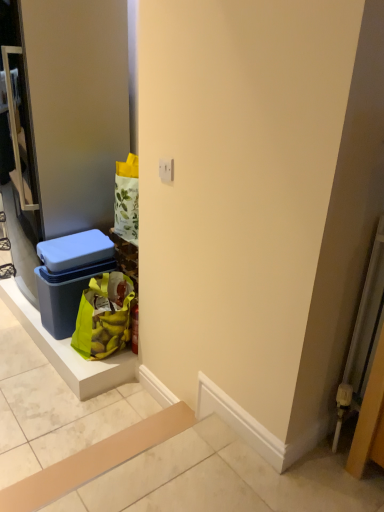
The image size is (384, 512). In order to click on blue plastic door at left in this screenshot , I will do `click(77, 106)`.

I want to click on green fabric shopping bag at lower left, so click(x=104, y=316).

The width and height of the screenshot is (384, 512). I want to click on blue plastic storage box at left, so click(69, 276).

From the image's perspective, which is below, blue plastic door at left or blue plastic storage box at left?

blue plastic storage box at left is shown below in the image.

In the image, is blue plastic door at left on the left side or the right side of blue plastic storage box at left?

Clearly, blue plastic door at left is on the left of blue plastic storage box at left in the image.

Which object is wider, blue plastic door at left or blue plastic storage box at left?

With larger width is blue plastic door at left.

The width and height of the screenshot is (384, 512). Identify the location of shopping bag on the right of the blue plastic door at left. (104, 316).

Which is in front, point (98, 350) or point (53, 168)?

The point (98, 350) is closer.

Is green fabric shopping bag at lower left not near blue plastic door at left?

No, there isn't a large distance between green fabric shopping bag at lower left and blue plastic door at left.

From a real-world perspective, does blue plastic storage box at left sit lower than blue plastic door at left?

Yes, from a real-world perspective, blue plastic storage box at left is under blue plastic door at left.

Between blue plastic storage box at left and blue plastic door at left, which one appears on the right side from the viewer's perspective?

blue plastic storage box at left.

Which point is more forward, (x=62, y=279) or (x=102, y=4)?

The point (x=102, y=4) is in front.

Consider the image. From the image's perspective, does blue plastic storage box at left appear higher than blue plastic door at left?

No, from the image's perspective, blue plastic storage box at left is not on top of blue plastic door at left.

How different are the orientations of green fabric shopping bag at lower left and blue plastic storage box at left in degrees?

0.000412 degrees separate the facing orientations of green fabric shopping bag at lower left and blue plastic storage box at left.

Which of these two, green fabric shopping bag at lower left or blue plastic storage box at left, is thinner?

green fabric shopping bag at lower left is thinner.

Would you say green fabric shopping bag at lower left is inside or outside blue plastic storage box at left?

green fabric shopping bag at lower left is located beyond the bounds of blue plastic storage box at left.

Between blue plastic door at left and green fabric shopping bag at lower left, which one has less height?

With less height is green fabric shopping bag at lower left.

Would you say blue plastic door at left is a long distance from green fabric shopping bag at lower left?

They are positioned close to each other.

Is blue plastic door at left to the left of green fabric shopping bag at lower left from the viewer's perspective?

Indeed, blue plastic door at left is positioned on the left side of green fabric shopping bag at lower left.

Considering the relative sizes of blue plastic door at left and green fabric shopping bag at lower left in the image provided, is blue plastic door at left bigger than green fabric shopping bag at lower left?

Correct, blue plastic door at left is larger in size than green fabric shopping bag at lower left.

Which object is closer to the camera taking this photo, blue plastic storage box at left or green fabric shopping bag at lower left?

green fabric shopping bag at lower left.

Are blue plastic storage box at left and green fabric shopping bag at lower left beside each other?

No, blue plastic storage box at left is not making contact with green fabric shopping bag at lower left.

Identify the location of shopping bag in front of the blue plastic storage box at left. (104, 316).

Between point (66, 329) and point (116, 296), which one is positioned in front?

The point (116, 296) is closer to the camera.

Locate an element on the screen. door located in front of the blue plastic storage box at left is located at coordinates (77, 106).

The image size is (384, 512). Identify the location of shopping bag beneath the blue plastic door at left (from a real-world perspective). pyautogui.click(x=104, y=316).

When comparing their distances from blue plastic door at left, does blue plastic storage box at left or green fabric shopping bag at lower left seem closer?

blue plastic storage box at left is positioned closer to the anchor blue plastic door at left.

Which object lies further to the anchor point green fabric shopping bag at lower left, blue plastic storage box at left or blue plastic door at left?

blue plastic door at left is positioned further to the anchor green fabric shopping bag at lower left.

Considering their positions, is blue plastic door at left positioned closer to green fabric shopping bag at lower left than blue plastic storage box at left?

blue plastic storage box at left.

Based on their spatial positions, is green fabric shopping bag at lower left or blue plastic storage box at left closer to blue plastic door at left?

Among the two, blue plastic storage box at left is located nearer to blue plastic door at left.

Which object lies further to the anchor point blue plastic storage box at left, blue plastic door at left or green fabric shopping bag at lower left?

blue plastic door at left.

Which object lies further to the anchor point blue plastic storage box at left, green fabric shopping bag at lower left or blue plastic door at left?

Among the two, blue plastic door at left is located further to blue plastic storage box at left.

In order to click on storage box that lies between blue plastic door at left and green fabric shopping bag at lower left from top to bottom in this screenshot , I will do `click(69, 276)`.